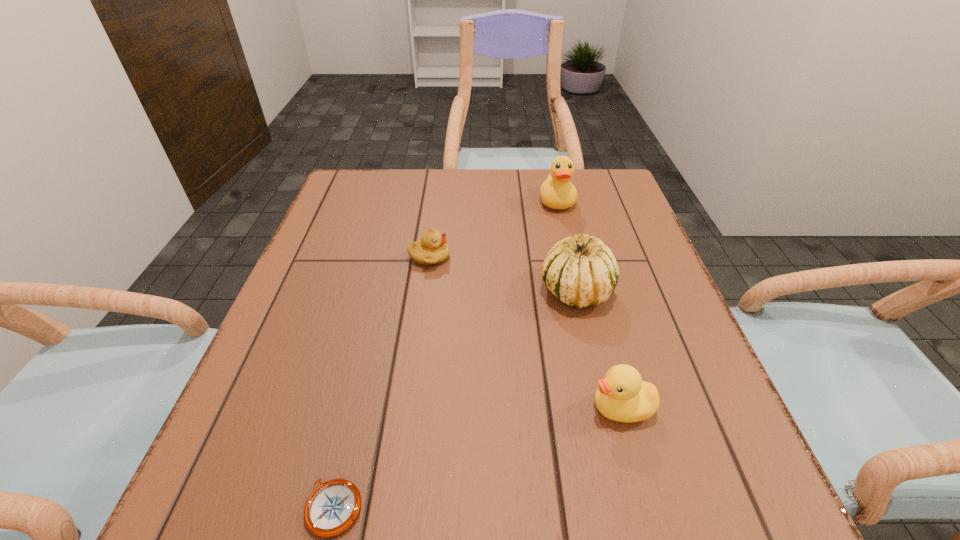
Locate an element on the screen. The width and height of the screenshot is (960, 540). free space in the image that satisfies the following two spatial constraints: 1. at the beak of the gourd; 2. on the left side of the duckling is located at coordinates (425, 290).

The image size is (960, 540). I want to click on vacant area in the image that satisfies the following two spatial constraints: 1. at the beak of the farthest object; 2. at the beak of the duckling, so click(x=570, y=258).